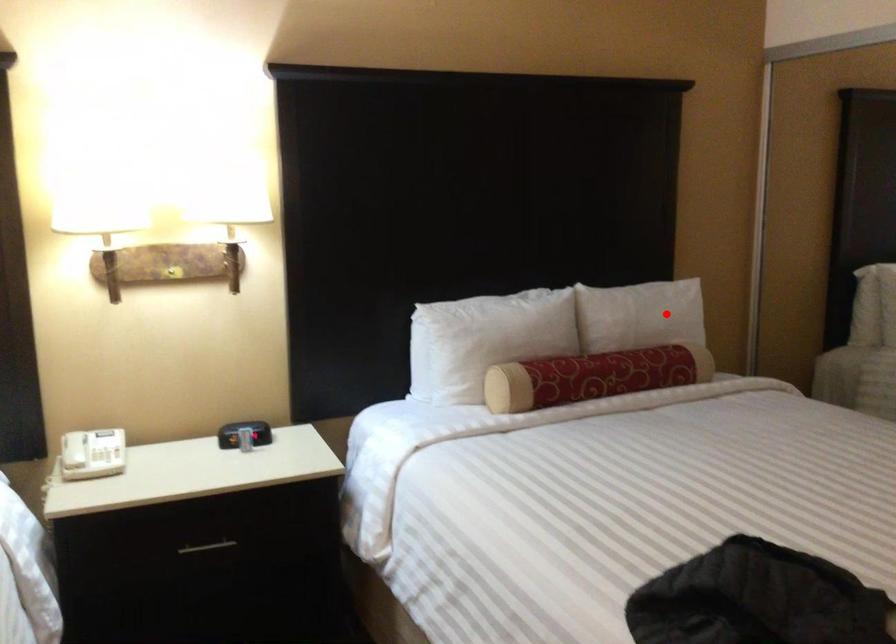
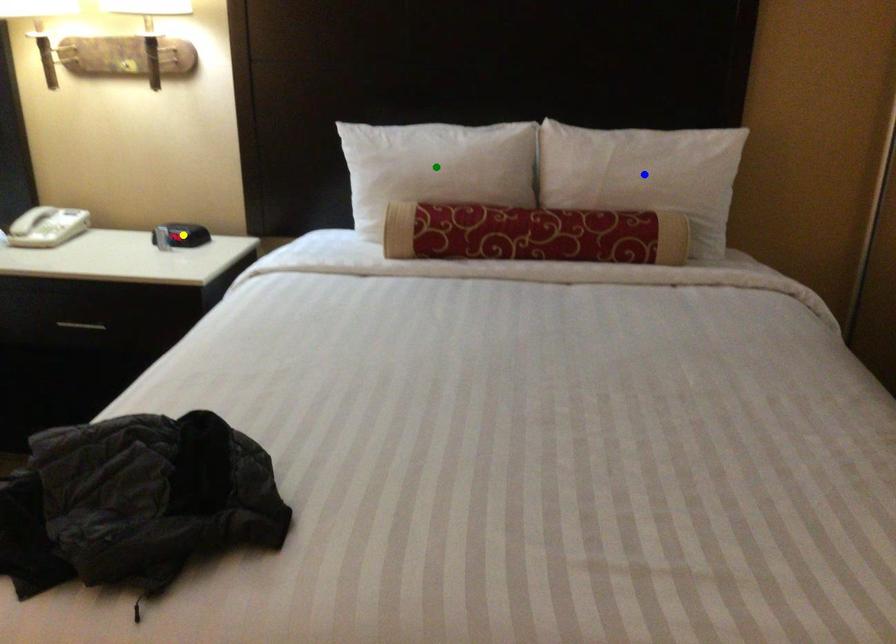
Question: I am providing you with two images of the same scene from different viewpoints. A red point is marked on the first image. You are given multiple points on the second image. Can you choose the point in image 2 that corresponds to the point in image 1?

Choices:
 (A) green point
 (B) yellow point
 (C) blue point

Answer: (C)